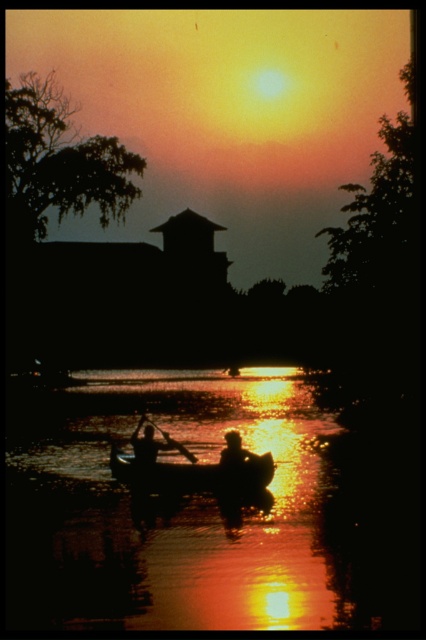
Question: Does silky water at center appear on the right side of silhouette human at center?

Choices:
 (A) no
 (B) yes

Answer: (A)

Question: Is silky water at center bigger than silhouette wooden paddle at center?

Choices:
 (A) yes
 (B) no

Answer: (A)

Question: Which is farther from the silhouette human at center?

Choices:
 (A) silhouette wooden paddle at center
 (B) wooden smooth paddle at center

Answer: (B)

Question: Where is silky water at center located in relation to silhouette human at center in the image?

Choices:
 (A) above
 (B) below

Answer: (A)

Question: Which of the following is the closest to the observer?

Choices:
 (A) silky water at center
 (B) silhouette human at center

Answer: (A)

Question: Which is farther from the silhouette wood canoe at center?

Choices:
 (A) silhouette human at center
 (B) silhouette wooden paddle at center
 (C) wooden smooth paddle at center

Answer: (A)